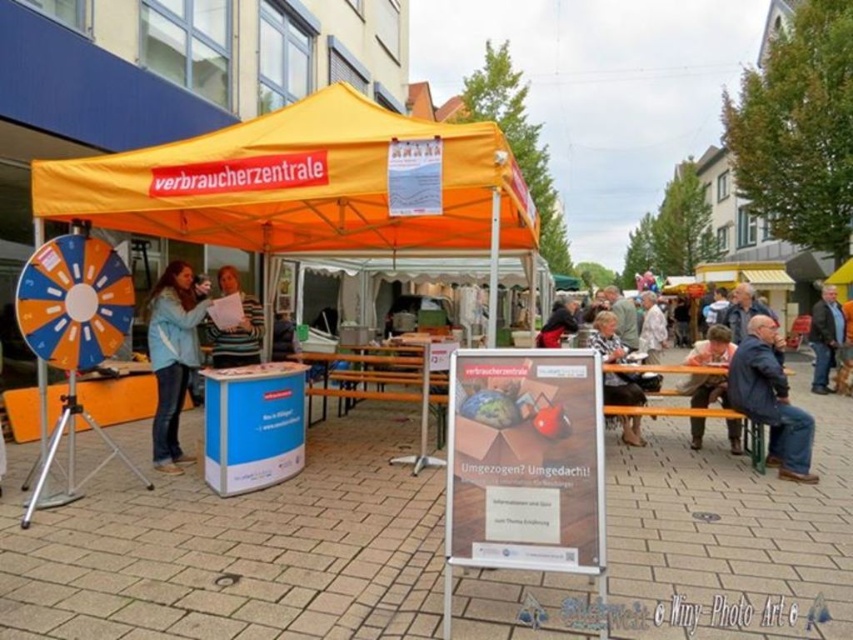
Between dark brown leather jacket at right and light brown leather jacket at center, which one is positioned lower?

dark brown leather jacket at right is lower down.

Does dark brown leather jacket at right appear on the right side of light brown leather jacket at center?

Correct, you'll find dark brown leather jacket at right to the right of light brown leather jacket at center.

What do you see at coordinates (825, 337) in the screenshot?
I see `dark brown leather jacket at right` at bounding box center [825, 337].

Where is `dark brown leather jacket at right`? The height and width of the screenshot is (640, 853). dark brown leather jacket at right is located at coordinates (825, 337).

Which is more to the right, striped sweater at center or dark gray sweater at center?

From the viewer's perspective, dark gray sweater at center appears more on the right side.

Is striped sweater at center below dark gray sweater at center?

No.

Between point (245, 310) and point (537, 333), which one is positioned in front?

Point (245, 310) is more forward.

In order to click on striped sweater at center in this screenshot , I will do `click(236, 326)`.

Does blue denim jeans at lower right have a greater width compared to dark gray sweater at center?

No, blue denim jeans at lower right is not wider than dark gray sweater at center.

Does point (724, 404) lie behind point (556, 307)?

No, (724, 404) is in front of (556, 307).

Image resolution: width=853 pixels, height=640 pixels. What do you see at coordinates (712, 348) in the screenshot?
I see `blue denim jeans at lower right` at bounding box center [712, 348].

Find the location of a particular element. blue denim jeans at lower right is located at coordinates (712, 348).